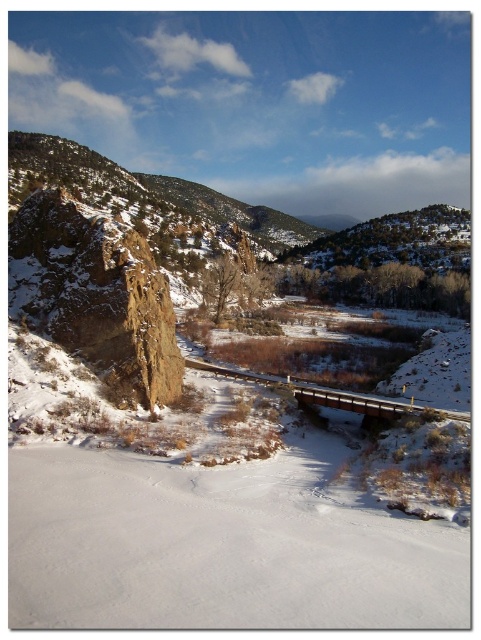
Question: Among these points, which one is nearest to the camera?

Choices:
 (A) (103, 241)
 (B) (341, 396)

Answer: (A)

Question: Which point is closer to the camera?

Choices:
 (A) brown wooden bridge at center
 (B) brown rough rock at left

Answer: (A)

Question: Does brown rough rock at left have a lesser width compared to brown wooden bridge at center?

Choices:
 (A) no
 (B) yes

Answer: (B)

Question: Is brown rough rock at left bigger than brown wooden bridge at center?

Choices:
 (A) no
 (B) yes

Answer: (B)

Question: Does brown rough rock at left appear over brown wooden bridge at center?

Choices:
 (A) no
 (B) yes

Answer: (B)